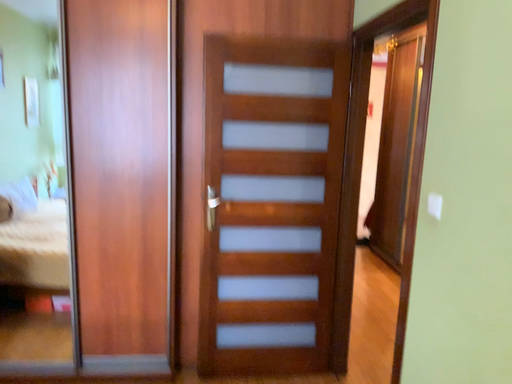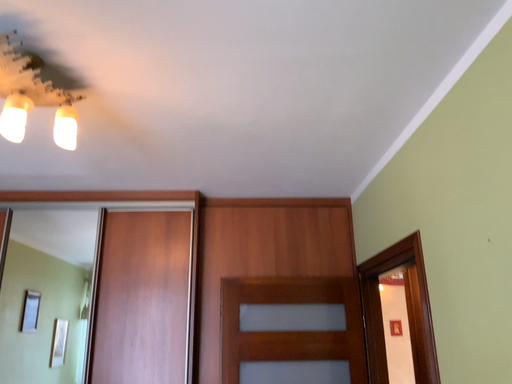
Question: Which way did the camera rotate in the video?

Choices:
 (A) rotated downward
 (B) rotated upward

Answer: (B)